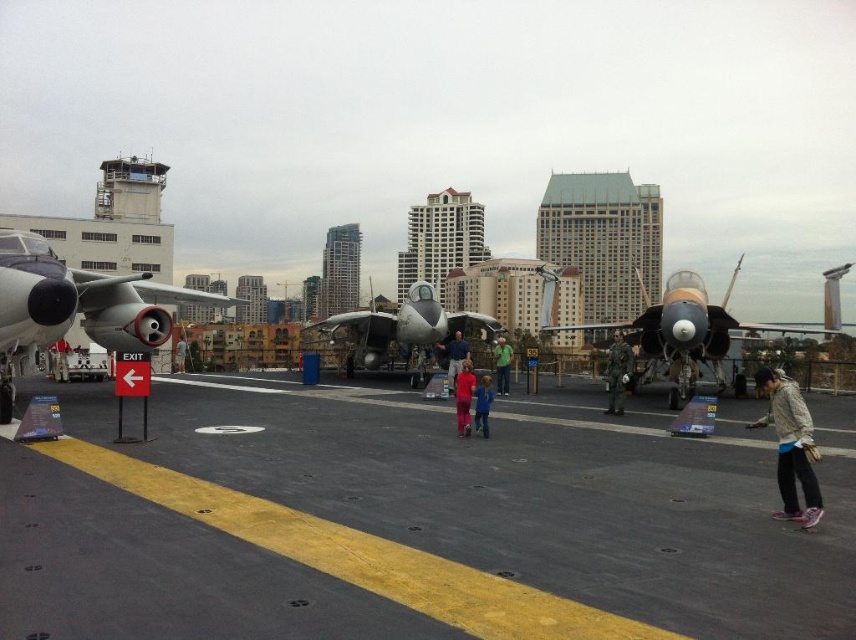
Question: Observing the image, what is the correct spatial positioning of matte gray fighter jet at center in reference to matte pink jacket at center?

Choices:
 (A) above
 (B) below

Answer: (A)

Question: In this image, where is green matte uniform at center located relative to matte gray fighter jet at center?

Choices:
 (A) left
 (B) right

Answer: (B)

Question: Which point is farther to the camera?

Choices:
 (A) (183, 356)
 (B) (613, 376)
 (C) (464, 403)

Answer: (A)

Question: Which of the following is the closest to the observer?

Choices:
 (A) (103, 572)
 (B) (182, 346)
 (C) (620, 364)

Answer: (A)

Question: Which point is farther from the camera taking this photo?

Choices:
 (A) (186, 348)
 (B) (458, 358)

Answer: (A)

Question: Where is green matte uniform at center located in relation to matte pink jacket at center in the image?

Choices:
 (A) left
 (B) right

Answer: (B)